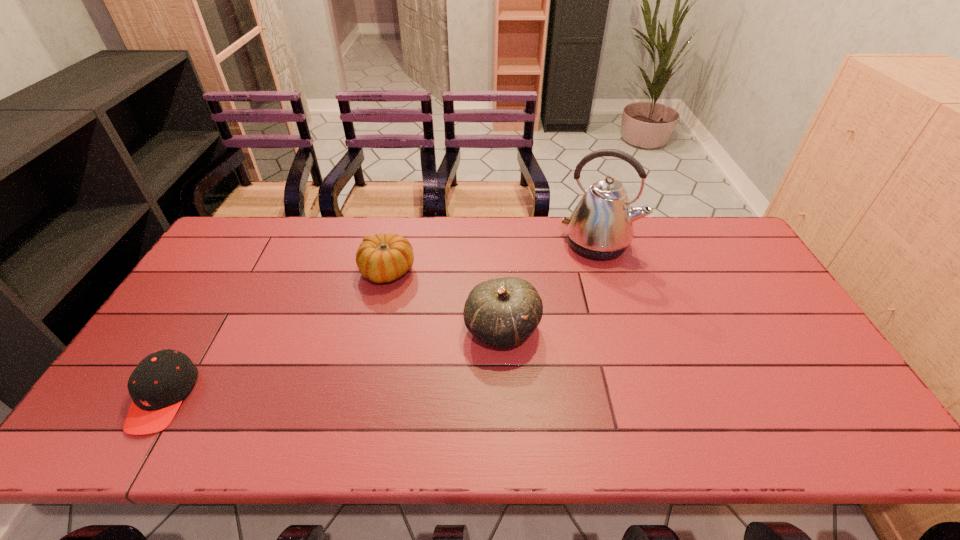
You are a GUI agent. You are given a task and a screenshot of the screen. Output one action in this format:
    pyautogui.click(x=<x>, y=<y>)
    Task: Click on the unoccupied area between the second object from left to right and the rightmost object
    Image resolution: width=960 pixels, height=540 pixels.
    Given the screenshot: What is the action you would take?
    pyautogui.click(x=492, y=258)

This screenshot has width=960, height=540. Identify the location of free space between the taller gourd and the cap. (333, 363).

What are the coordinates of `free area in between the tallest object and the shorter gourd` in the screenshot? It's located at (492, 258).

You are a GUI agent. You are given a task and a screenshot of the screen. Output one action in this format:
    pyautogui.click(x=<x>, y=<y>)
    Task: Click on the free space between the nearest object and the rightmost object
    This screenshot has height=540, width=960.
    Given the screenshot: What is the action you would take?
    pyautogui.click(x=380, y=321)

Where is `free spot between the rightmost object and the nearer gourd`? free spot between the rightmost object and the nearer gourd is located at coordinates (550, 286).

Where is `vacant area that lies between the shortest object and the farther gourd`? This screenshot has height=540, width=960. vacant area that lies between the shortest object and the farther gourd is located at coordinates (276, 334).

Locate an element on the screen. The image size is (960, 540). unoccupied area between the rightmost object and the shortest object is located at coordinates (380, 321).

This screenshot has width=960, height=540. Identify the location of empty location between the second object from left to right and the nearest object. (276, 334).

At what (x,y) coordinates should I click in order to perform the action: click on vacant area between the leftmost object and the nearer gourd. Please return your answer as a coordinate pair (x, y). This screenshot has height=540, width=960. Looking at the image, I should click on (333, 363).

Image resolution: width=960 pixels, height=540 pixels. Find the location of `free area in between the second object from left to right and the nearest object`. free area in between the second object from left to right and the nearest object is located at coordinates (276, 334).